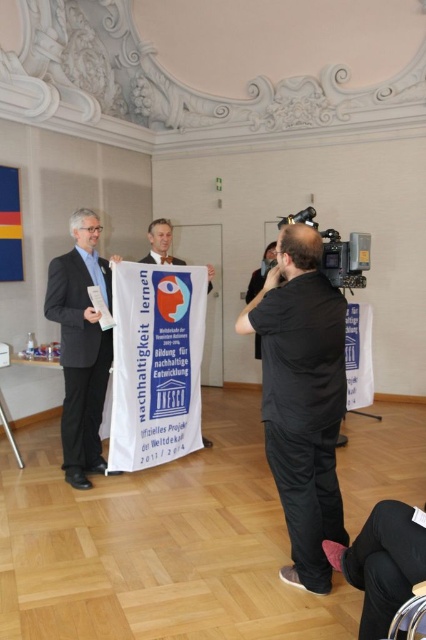
Image resolution: width=426 pixels, height=640 pixels. Describe the element at coordinates (302, 397) in the screenshot. I see `black matte shirt at center` at that location.

At what (x,y) coordinates should I click in order to perform the action: click on black matte shirt at center. Please return your answer as a coordinate pair (x, y). The width and height of the screenshot is (426, 640). Looking at the image, I should click on (302, 397).

Does point (333, 316) lie in front of point (81, 435)?

That is True.

You are a GUI agent. You are given a task and a screenshot of the screen. Output one action in this format:
    pyautogui.click(x=<x>, y=<y>)
    Task: Click on the black matte shirt at center
    This screenshot has width=426, height=640.
    Given the screenshot: What is the action you would take?
    pyautogui.click(x=302, y=397)